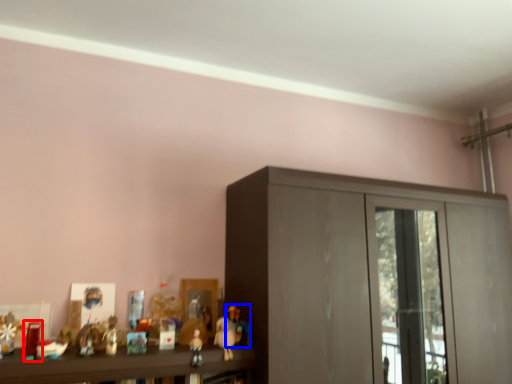
Question: Which of the following is the closest to the observer, toy (highlighted by a red box) or toy (highlighted by a blue box)?

Choices:
 (A) toy
 (B) toy

Answer: (A)